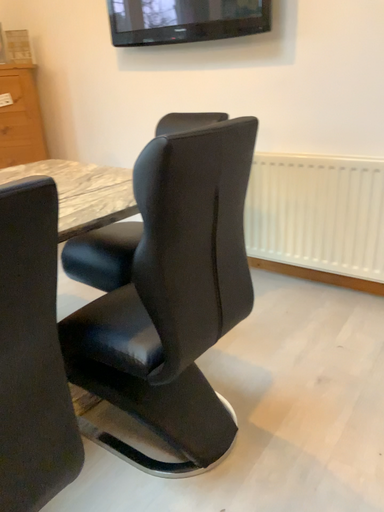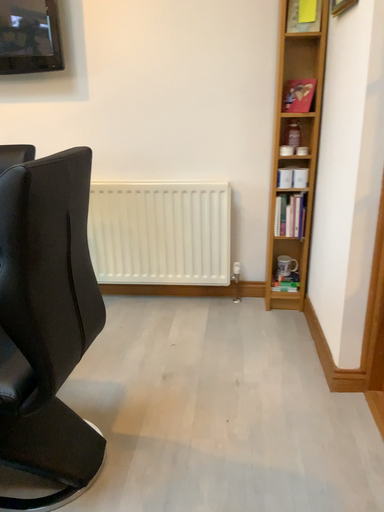
Question: Which way did the camera rotate in the video?

Choices:
 (A) rotated upward
 (B) rotated downward

Answer: (A)